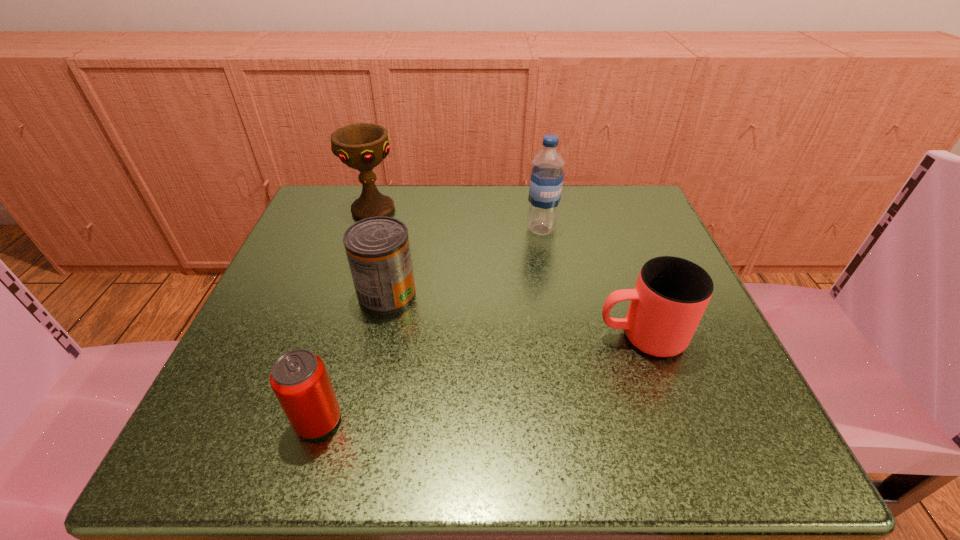
At what (x,y) coordinates should I click in order to perform the action: click on free spot between the farther can and the nearer can. Please return your answer as a coordinate pair (x, y). Looking at the image, I should click on (353, 358).

You are a GUI agent. You are given a task and a screenshot of the screen. Output one action in this format:
    pyautogui.click(x=<x>, y=<y>)
    Task: Click on the free space between the rightmost object and the fourth object from left to right
    The image size is (960, 540).
    Given the screenshot: What is the action you would take?
    pyautogui.click(x=591, y=283)

Where is `free space between the rightmost object and the farther can`? free space between the rightmost object and the farther can is located at coordinates (514, 315).

Locate an element on the screen. The image size is (960, 540). vacant space that is in between the farther can and the rightmost object is located at coordinates (514, 315).

Where is `vacant region between the chalice and the rightmost object`? Image resolution: width=960 pixels, height=540 pixels. vacant region between the chalice and the rightmost object is located at coordinates (507, 273).

Select which object is the fourth closest to the fourth object from left to right. Please provide its 2D coordinates. Your answer should be formatted as a tuple, i.e. [(x, y)], where the tuple contains the x and y coordinates of a point satisfying the conditions above.

[(299, 379)]

Where is `object identified as the second closest to the chalice`? Image resolution: width=960 pixels, height=540 pixels. object identified as the second closest to the chalice is located at coordinates (547, 175).

At what (x,y) coordinates should I click in order to perform the action: click on free space that satisfies the following two spatial constraints: 1. on the front side of the farther can; 2. on the handle side of the rightmost object. Please return your answer as a coordinate pair (x, y). The image size is (960, 540). Looking at the image, I should click on (378, 336).

Where is `free point that satisfies the following two spatial constraints: 1. on the front side of the chalice; 2. on the left side of the nearer can`? free point that satisfies the following two spatial constraints: 1. on the front side of the chalice; 2. on the left side of the nearer can is located at coordinates (305, 421).

This screenshot has width=960, height=540. What are the coordinates of `blank area in the image that satisfies the following two spatial constraints: 1. on the handle side of the rightmost object; 2. on the label of the water bottle` in the screenshot? It's located at (603, 230).